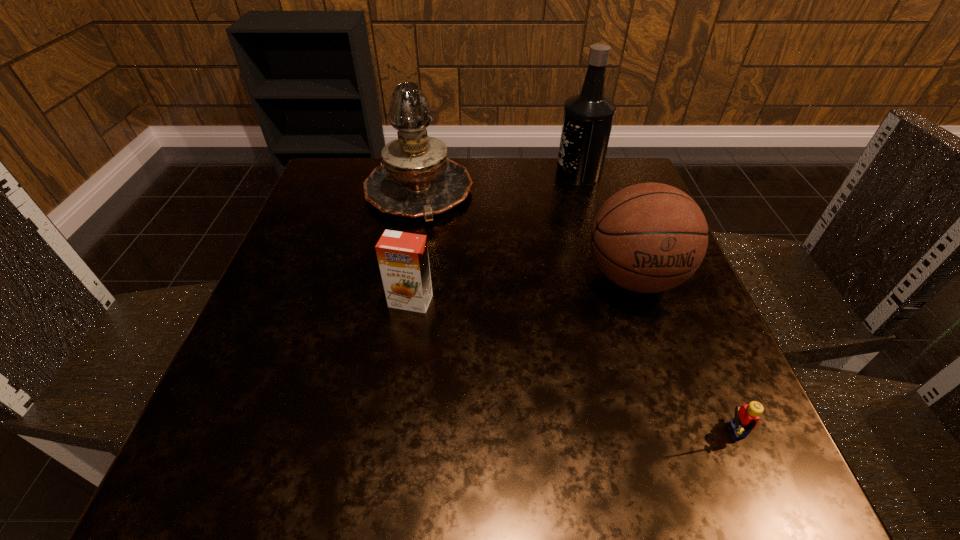
The height and width of the screenshot is (540, 960). Find the location of `basketball positioned at the right edge`. basketball positioned at the right edge is located at coordinates (650, 237).

Find the location of `Lego that is positioned at the right edge`. Lego that is positioned at the right edge is located at coordinates (746, 418).

The height and width of the screenshot is (540, 960). In order to click on object located in the far left corner section of the desktop in this screenshot , I will do pos(416,179).

In order to click on object that is at the far right corner in this screenshot , I will do `click(588, 117)`.

Find the location of a particular element. The height and width of the screenshot is (540, 960). object present at the near right corner is located at coordinates (746, 418).

Locate an element on the screen. The height and width of the screenshot is (540, 960). vacant area at the far edge is located at coordinates (530, 202).

At what (x,y) coordinates should I click in order to perform the action: click on vacant space at the near edge of the desktop. Please return your answer as a coordinate pair (x, y). Looking at the image, I should click on (636, 431).

Locate an element on the screen. free location at the left edge is located at coordinates (312, 215).

Image resolution: width=960 pixels, height=540 pixels. I want to click on free region at the right edge of the desktop, so click(724, 362).

The width and height of the screenshot is (960, 540). I want to click on free point at the far left corner, so click(x=363, y=169).